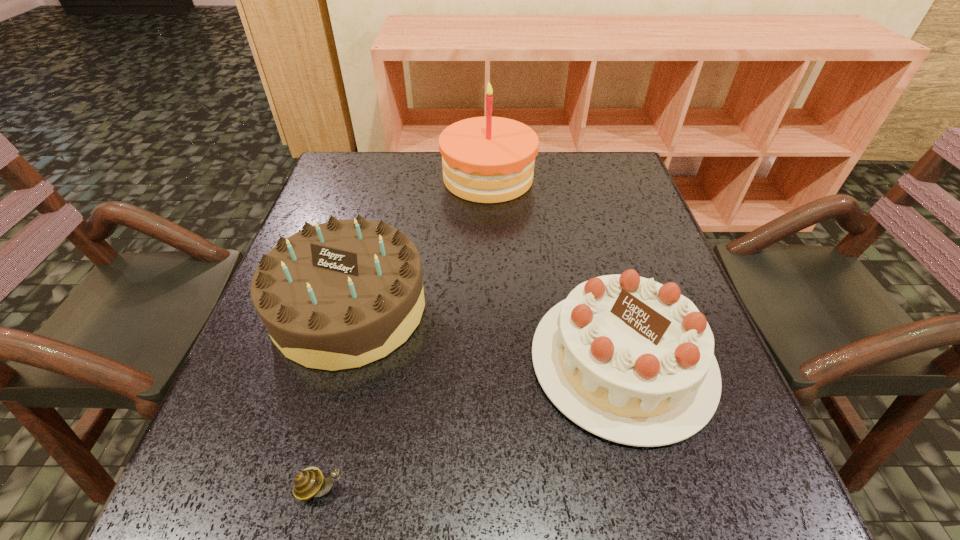
Where is `birthday cake present at the left edge`? birthday cake present at the left edge is located at coordinates (338, 295).

Where is `snail present at the left edge`? The height and width of the screenshot is (540, 960). snail present at the left edge is located at coordinates (307, 484).

Where is `object positioned at the right edge`? This screenshot has width=960, height=540. object positioned at the right edge is located at coordinates (631, 360).

Where is `object that is at the near left corner`? Image resolution: width=960 pixels, height=540 pixels. object that is at the near left corner is located at coordinates (307, 484).

The height and width of the screenshot is (540, 960). In the image, there is a desktop. Find the location of `vacant space at the far edge`. vacant space at the far edge is located at coordinates (428, 152).

Locate an element on the screen. free space at the left edge is located at coordinates (278, 360).

This screenshot has height=540, width=960. Identify the location of free region at the right edge. (597, 255).

At what (x,y) coordinates should I click in order to perform the action: click on vacant space at the far left corner. Please return your answer as a coordinate pair (x, y). The height and width of the screenshot is (540, 960). Looking at the image, I should click on (354, 158).

The image size is (960, 540). What are the coordinates of `vacant region at the near left corner of the desktop` in the screenshot? It's located at (224, 515).

Find the location of a particular element. This screenshot has width=960, height=540. free space at the far right corner is located at coordinates (598, 185).